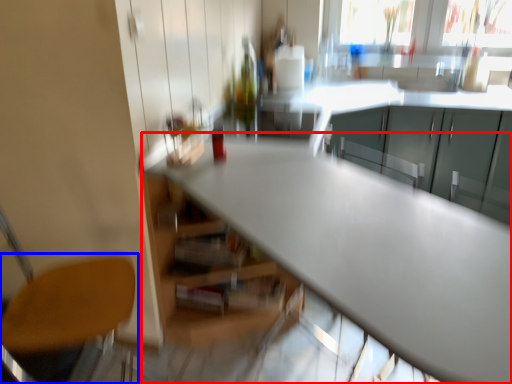
Question: Among these objects, which one is farthest to the camera, table (highlighted by a red box) or chair (highlighted by a blue box)?

Choices:
 (A) table
 (B) chair

Answer: (B)